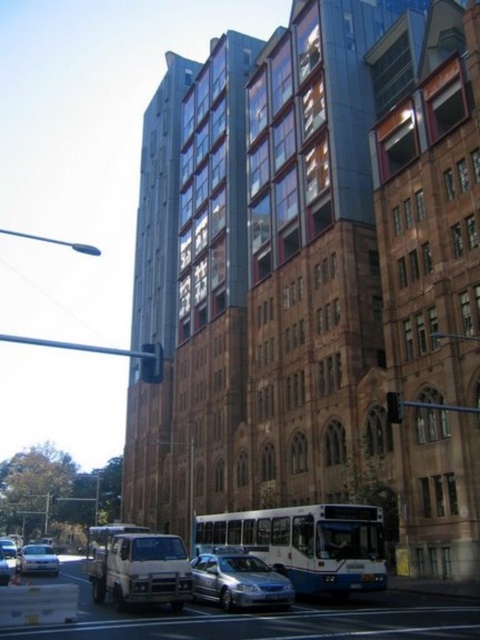
You are standing at the point marked as point (307, 544) in the urban street scene. Which direction should you walk to reach the white matte bus at center?

The white matte bus at center is located exactly at point (307, 544), so you are already at the location of the white matte bus at center.

You are a pedestrian standing at the intersection and want to cross the street to reach the modern glass building on the left. There is a white matte bus at center and a silver metallic sedan at lower left in your view. Which vehicle should you avoid stepping in front of to cross safely?

You should avoid stepping in front of the white matte bus at center because it is positioned to the right of the silver metallic sedan at lower left, meaning it is closer to your path as you cross towards the modern glass building on the left.

You are a delivery driver who needs to pass under the white matte bus at center with your truck. The truck has a height restriction of 4 meters. Can you safely pass under the bus without hitting the black plastic traffic light at center?

The white matte bus at center is taller than the black plastic traffic light at center. Since the bus is taller, but the traffic light is a separate object, the truck must ensure it doesn not hit the traffic light. However, without specific height data, we cannot confirm if the 4m clearance is sufficient. The answer is inconclusive based on provided info.